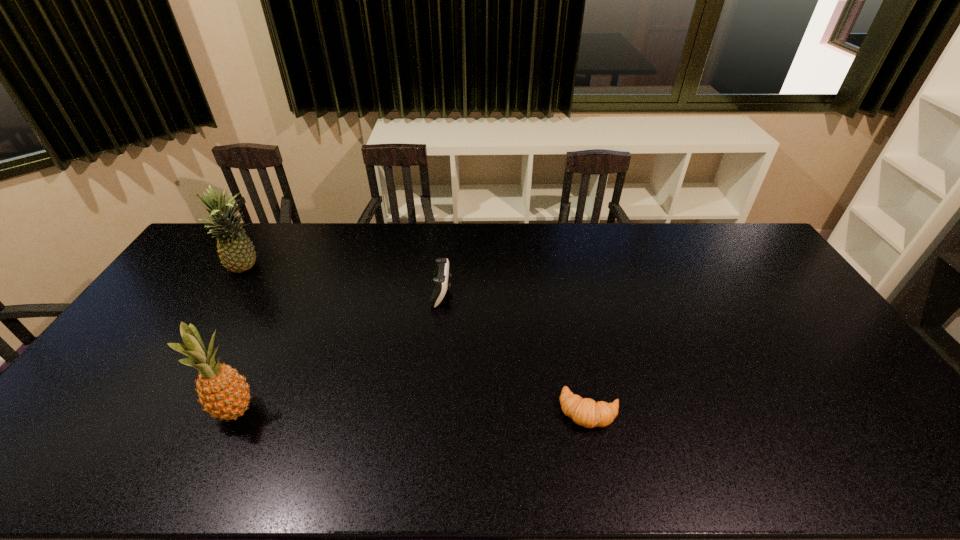
At what (x,y) coordinates should I click in order to perform the action: click on free spot located 0.310m on the front-facing side of the third tallest object. Please return your answer as a coordinate pair (x, y). Image resolution: width=960 pixels, height=540 pixels. Looking at the image, I should click on (545, 292).

The width and height of the screenshot is (960, 540). Identify the location of free space located on the left of the rightmost object. tap(470, 411).

Where is `object present at the far edge`? The image size is (960, 540). object present at the far edge is located at coordinates (236, 251).

Find the location of a particular element. object present at the left edge is located at coordinates [236, 251].

The width and height of the screenshot is (960, 540). I want to click on object that is positioned at the far left corner, so pos(236,251).

This screenshot has height=540, width=960. In the image, there is a desktop. Find the location of `vacant space at the far edge`. vacant space at the far edge is located at coordinates (390, 249).

Find the location of a particular element. free region at the near edge of the desktop is located at coordinates (815, 453).

The width and height of the screenshot is (960, 540). Find the location of `vacant space at the left edge`. vacant space at the left edge is located at coordinates (217, 278).

I want to click on free space at the right edge of the desktop, so click(x=854, y=372).

Where is `free area in between the crescent roll and the second shortest object`? The height and width of the screenshot is (540, 960). free area in between the crescent roll and the second shortest object is located at coordinates (516, 352).